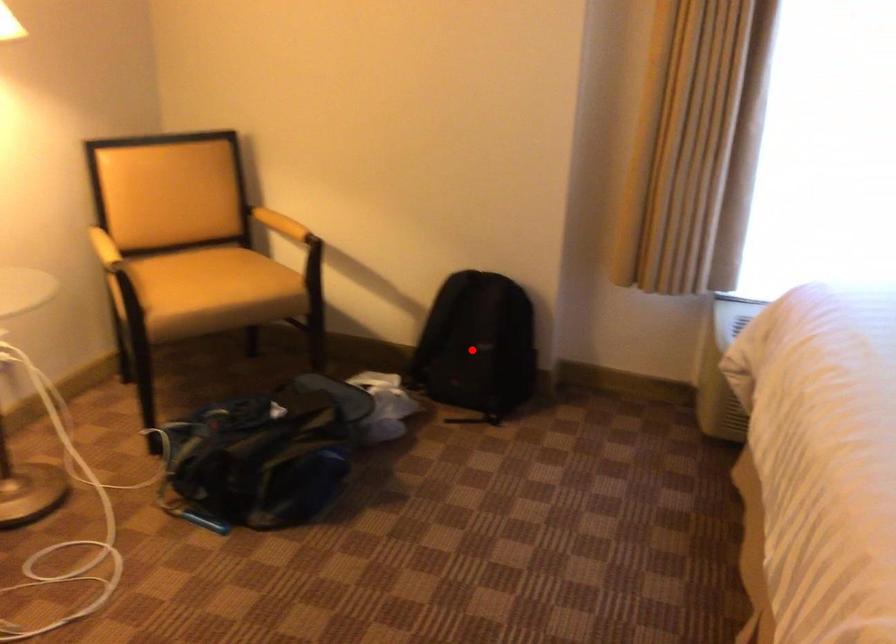
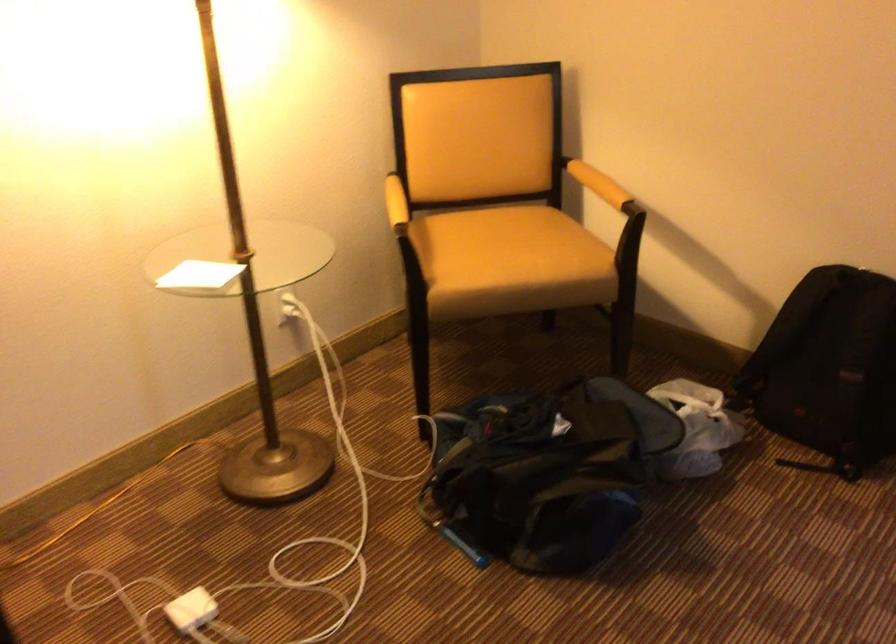
In the second image, find the point that corresponds to the highlighted location in the first image.

(829, 368)